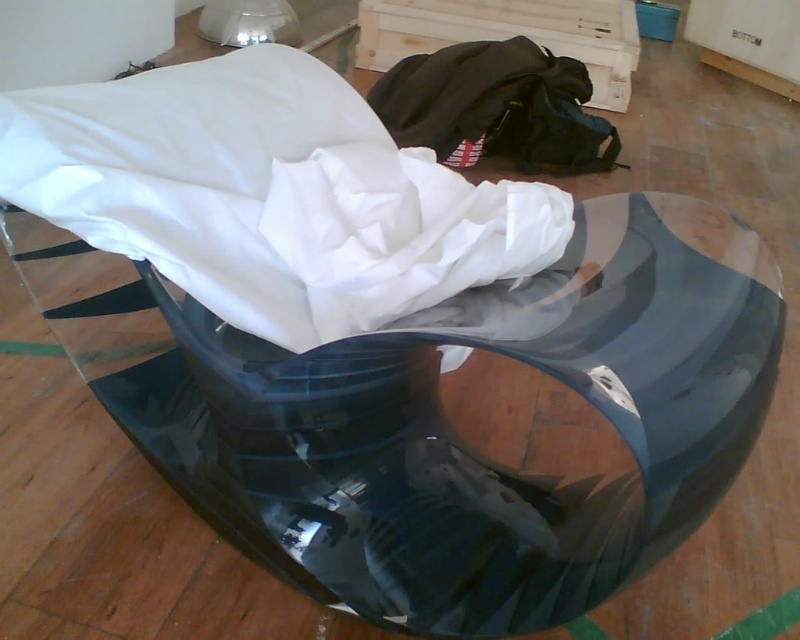
Based on the photo, you are standing in front of the sculpture and want to place a small vase on the transparent glossy glass table at center. However, you notice the white fabric at center is covering part of the table. Is the vase likely to be visible from your current position?

The transparent glossy glass table at center is to the left of white fabric at center. Since the fabric is covering part of the table, the vase might be partially obscured depending on where it is placed. If placed to the left of the fabric, it would be visible, but if under the fabric, it might not be seen.

You are an interior designer planning to place a small potted plant between the white fabric at center and the black fabric bean bag at center. Since the two objects are both at the center, how can you determine where to place the plant?

The white fabric at center is bigger than the black fabric bean bag at center, so you can place the plant between them by positioning it closer to the smaller black fabric bean bag at center to maintain balance.